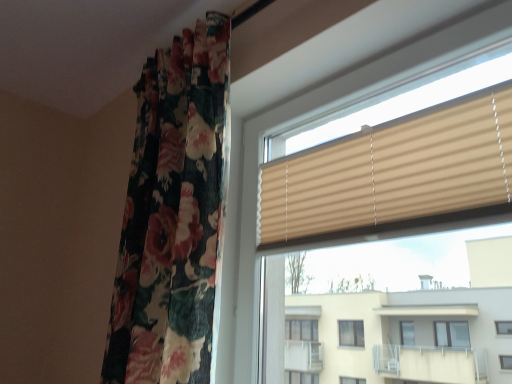
Question: From the image's perspective, is beige ribbed blind at upper right beneath floral fabric curtain at left?

Choices:
 (A) yes
 (B) no

Answer: (B)

Question: Does beige ribbed blind at upper right come in front of floral fabric curtain at left?

Choices:
 (A) no
 (B) yes

Answer: (B)

Question: Does beige ribbed blind at upper right have a greater width compared to floral fabric curtain at left?

Choices:
 (A) yes
 (B) no

Answer: (B)

Question: Is beige ribbed blind at upper right thinner than floral fabric curtain at left?

Choices:
 (A) no
 (B) yes

Answer: (B)

Question: Would you consider beige ribbed blind at upper right to be distant from floral fabric curtain at left?

Choices:
 (A) no
 (B) yes

Answer: (A)

Question: In terms of height, does beige ribbed blind at upper right look taller or shorter compared to floral fabric curtain at left?

Choices:
 (A) tall
 (B) short

Answer: (B)

Question: From a real-world perspective, relative to floral fabric curtain at left, is beige ribbed blind at upper right vertically above or below?

Choices:
 (A) above
 (B) below

Answer: (B)

Question: In the image, is beige ribbed blind at upper right on the left side or the right side of floral fabric curtain at left?

Choices:
 (A) left
 (B) right

Answer: (B)

Question: Considering the positions of point click(502, 210) and point click(109, 344), is point click(502, 210) closer or farther from the camera than point click(109, 344)?

Choices:
 (A) closer
 (B) farther

Answer: (A)

Question: From the image's perspective, is floral fabric curtain at left positioned above or below beige ribbed blind at upper right?

Choices:
 (A) below
 (B) above

Answer: (A)

Question: Does point (195, 205) appear closer or farther from the camera than point (354, 170)?

Choices:
 (A) closer
 (B) farther

Answer: (B)

Question: Considering the relative positions of floral fabric curtain at left and beige ribbed blind at upper right in the image provided, is floral fabric curtain at left to the left or to the right of beige ribbed blind at upper right?

Choices:
 (A) left
 (B) right

Answer: (A)

Question: Looking at their shapes, would you say floral fabric curtain at left is wider or thinner than beige ribbed blind at upper right?

Choices:
 (A) thin
 (B) wide

Answer: (B)

Question: Is point 207,286 closer or farther from the camera than point 238,332?

Choices:
 (A) farther
 (B) closer

Answer: (B)

Question: Is floral fabric curtain at left situated inside beige ribbed blinds at center or outside?

Choices:
 (A) outside
 (B) inside

Answer: (A)